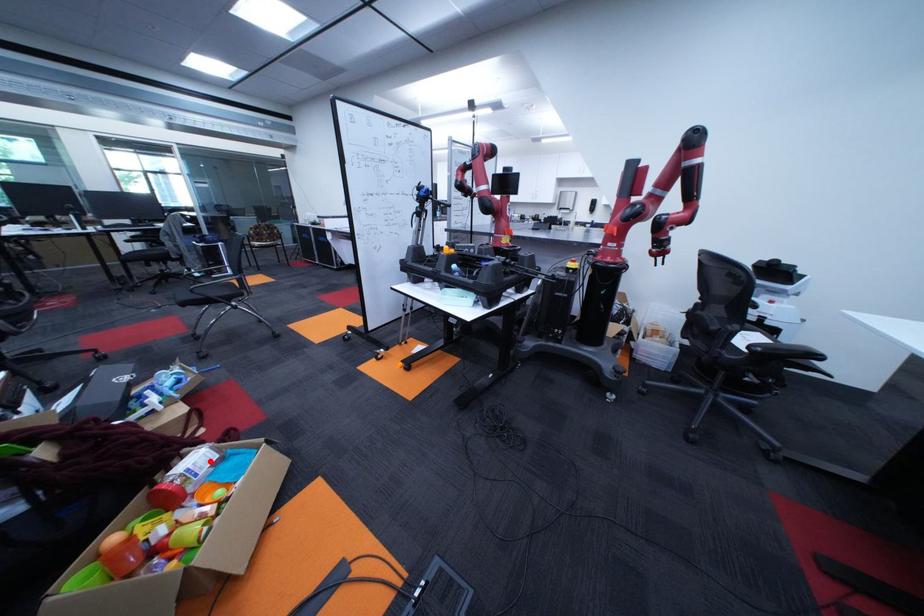
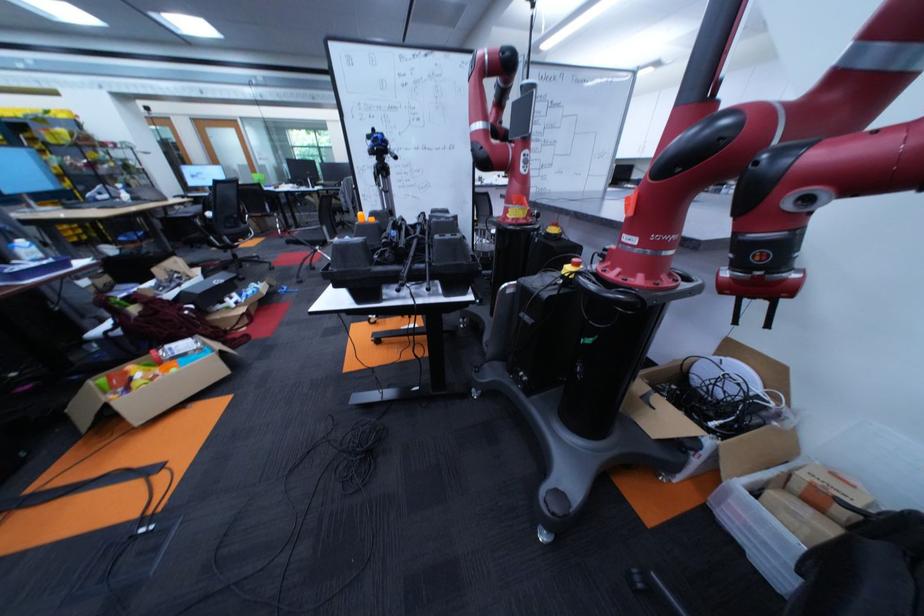
The point at the highlighted location is marked in the first image. Where is the corresponding point in the second image?

(198, 345)